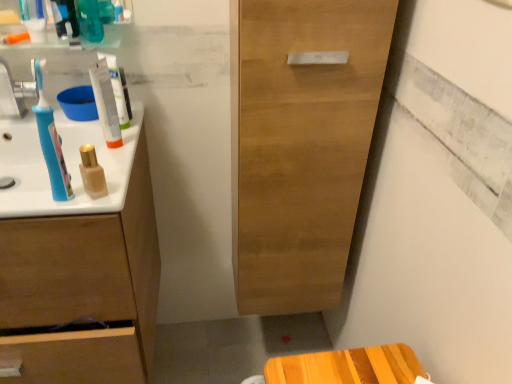
Question: From a real-world perspective, is blue plastic toothbrush at left positioned above or below white glossy sink at left?

Choices:
 (A) below
 (B) above

Answer: (B)

Question: Relative to white glossy sink at left, is blue plastic toothbrush at left in front or behind?

Choices:
 (A) behind
 (B) front

Answer: (B)

Question: Which is nearer to the blue plastic toothbrush at left?

Choices:
 (A) light brown wood cabinet at center
 (B) blue plastic toothbrush at left
 (C) teal glossy mouthwash at upper left, the first mouthwash positioned from the back
 (D) matte beige bottle at center, which appears as the 1th mouthwash when viewed from the right
 (E) matte brown cabinet at left

Answer: (C)

Question: Which is nearer to the matte beige bottle at center, which appears as the 1th mouthwash when viewed from the right?

Choices:
 (A) light brown wood cabinet at center
 (B) teal glossy mouthwash at upper left, the 2th mouthwash positioned from the front
 (C) blue plastic toothbrush at left
 (D) white glossy sink at left
 (E) blue plastic toothbrush at left

Answer: (E)